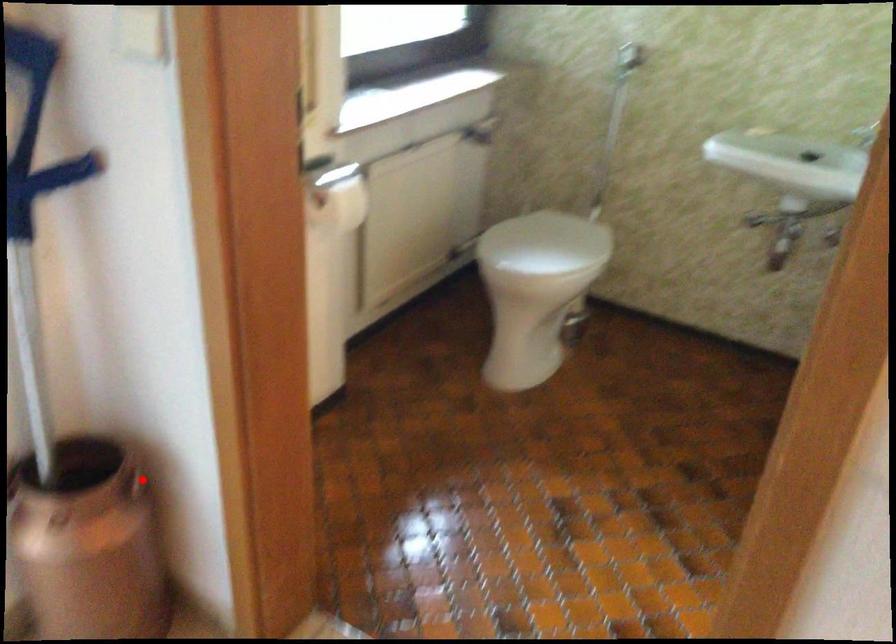
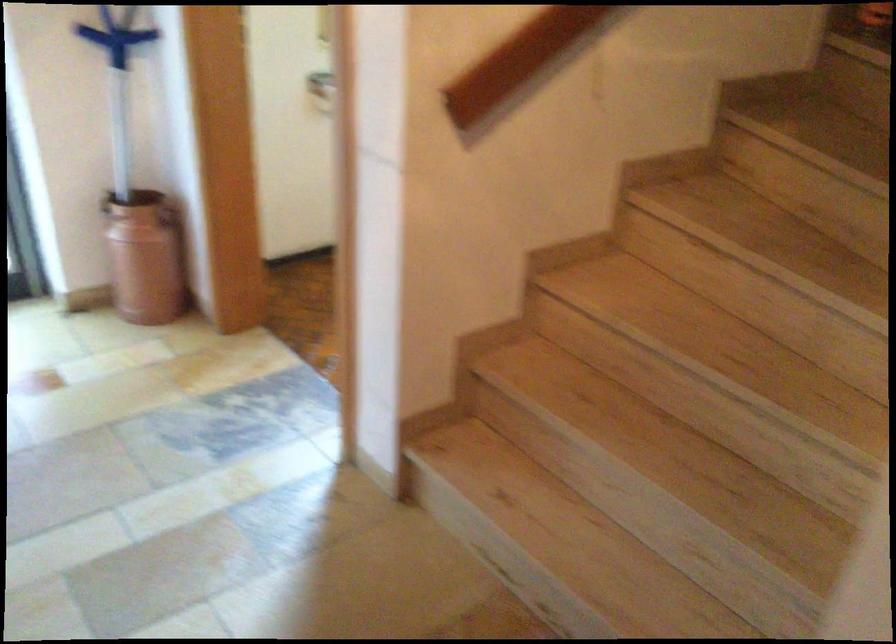
Question: A red point is marked in image1. In image2, is the corresponding 3D point closer to the camera or farther? Reply with the corresponding letter.

Choices:
 (A) The corresponding 3D point is closer.
 (B) The corresponding 3D point is farther.

Answer: (B)